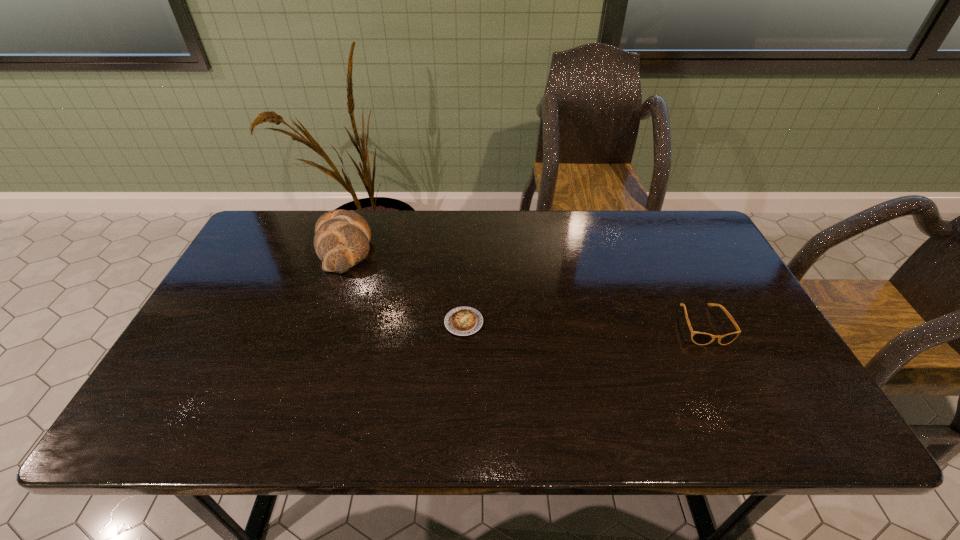
You are a GUI agent. You are given a task and a screenshot of the screen. Output one action in this format:
    pyautogui.click(x=<x>, y=<y>)
    Task: Click on the object that is at the right edge
    This screenshot has height=540, width=960.
    Given the screenshot: What is the action you would take?
    pyautogui.click(x=700, y=338)

This screenshot has width=960, height=540. In the image, there is a desktop. What are the coordinates of `free space at the far edge` in the screenshot? It's located at (535, 217).

Where is `free space at the near edge`? free space at the near edge is located at coordinates (465, 413).

In the image, there is a desktop. Where is `vacant space at the left edge`? The height and width of the screenshot is (540, 960). vacant space at the left edge is located at coordinates (222, 326).

This screenshot has width=960, height=540. In the image, there is a desktop. What are the coordinates of `free space at the right edge` in the screenshot? It's located at (744, 321).

In the image, there is a desktop. Where is `vacant space at the far right corner`? This screenshot has width=960, height=540. vacant space at the far right corner is located at coordinates click(686, 212).

Where is `empty space that is in between the sunglasses and the quiche`? This screenshot has width=960, height=540. empty space that is in between the sunglasses and the quiche is located at coordinates (584, 324).

You are a GUI agent. You are given a task and a screenshot of the screen. Output one action in this format:
    pyautogui.click(x=<x>, y=<y>)
    Task: Click on the empty location between the second shortest object and the tallest object
    This screenshot has width=960, height=540.
    Given the screenshot: What is the action you would take?
    pyautogui.click(x=524, y=286)

Where is `free spot between the farthest object and the rightmost object`? The image size is (960, 540). free spot between the farthest object and the rightmost object is located at coordinates click(524, 286).

This screenshot has width=960, height=540. What are the coordinates of `vacant region between the farthest object and the second object from left to right` in the screenshot? It's located at click(x=404, y=285).